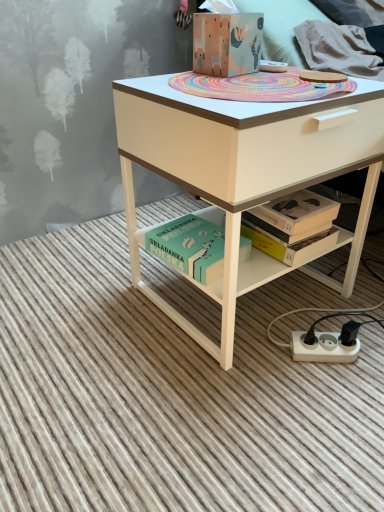
Where is `free space to the back side of white plastic power plugs and sockets at lower right`? Image resolution: width=384 pixels, height=512 pixels. free space to the back side of white plastic power plugs and sockets at lower right is located at coordinates (304, 304).